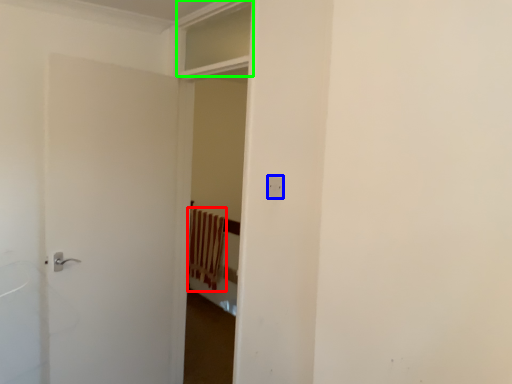
Question: Estimate the real-world distances between objects in this image. Which object is farther from curtain (highlighted by a red box), electric outlet (highlighted by a blue box) or window (highlighted by a green box)?

Choices:
 (A) electric outlet
 (B) window

Answer: (A)